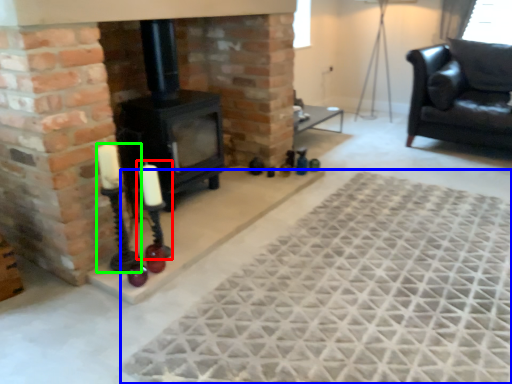
Question: Which object is the closest to the candle holder (highlighted by a red box)? Choose among these: mat (highlighted by a blue box) or candle holder (highlighted by a green box).

Choices:
 (A) mat
 (B) candle holder

Answer: (B)